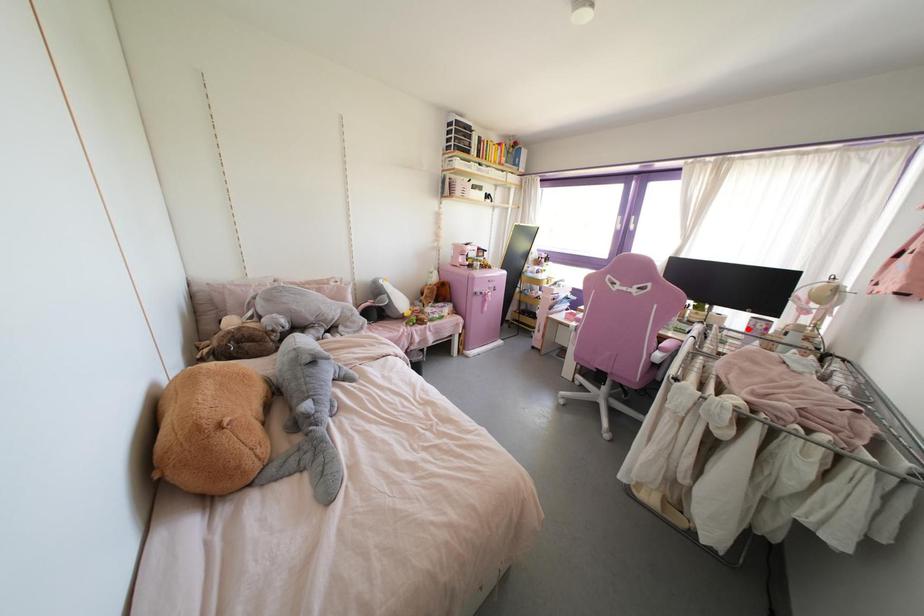
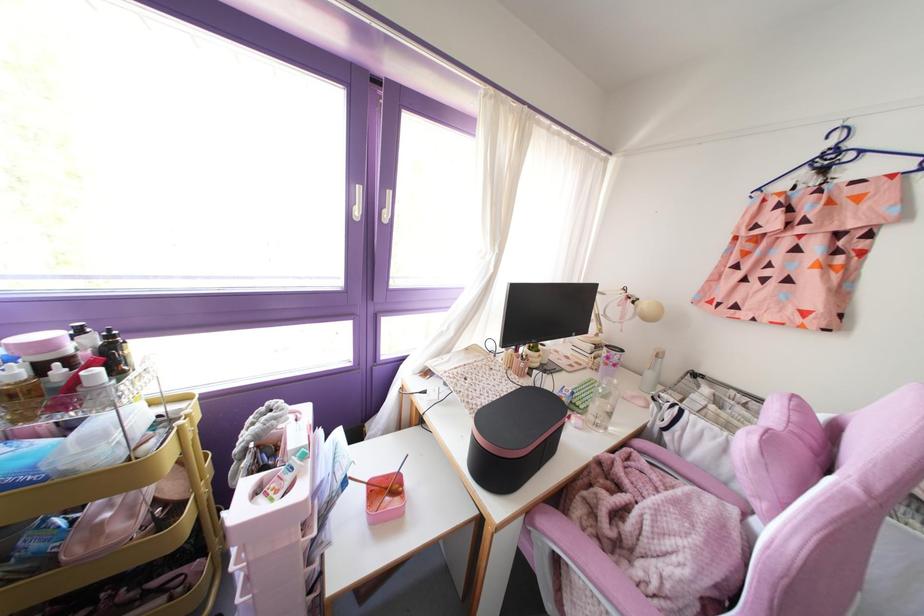
Locate, in the second image, the point that corresponds to the highlighted location in the first image.

(614, 365)